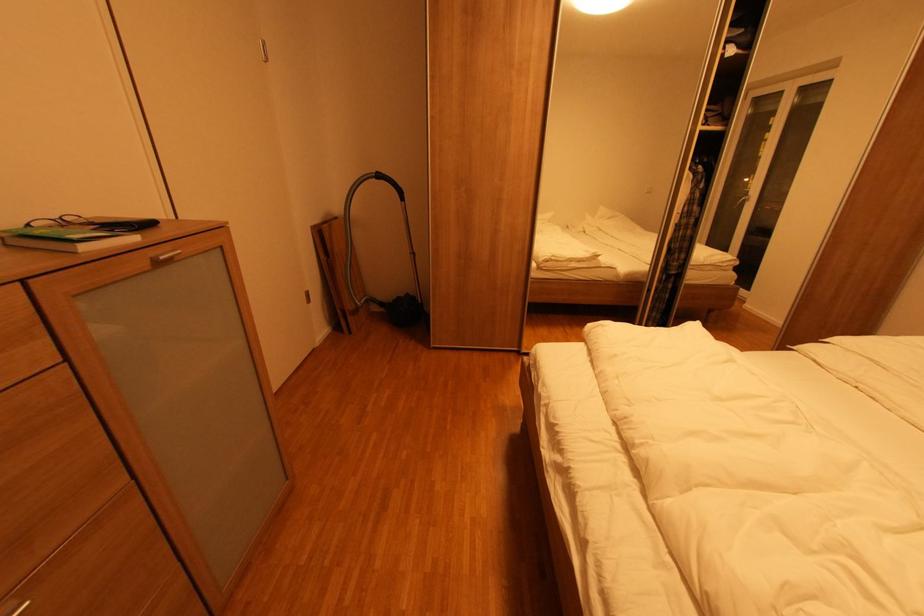
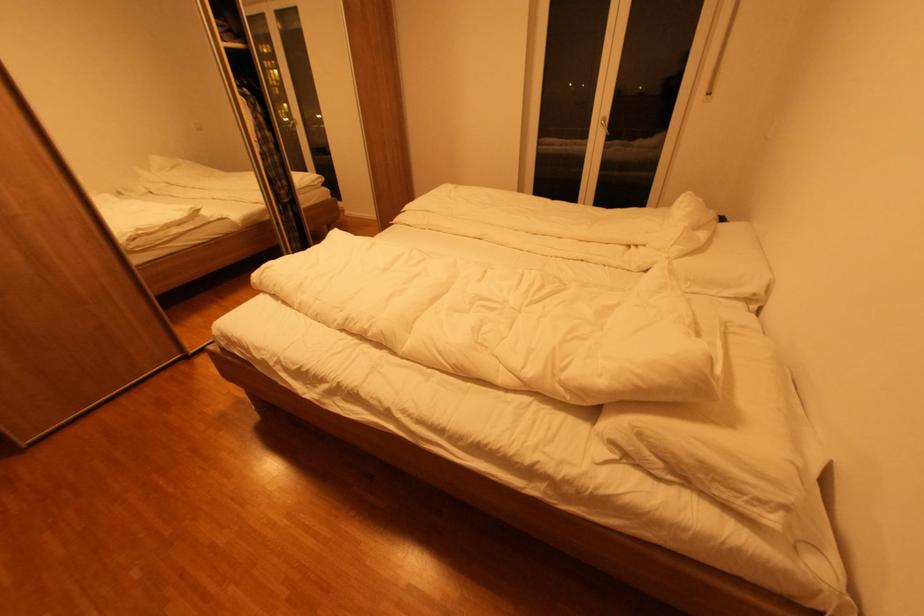
The first image is from the beginning of the video and the second image is from the end. How did the camera likely rotate when shooting the video?

The camera's rotation is toward right-down.